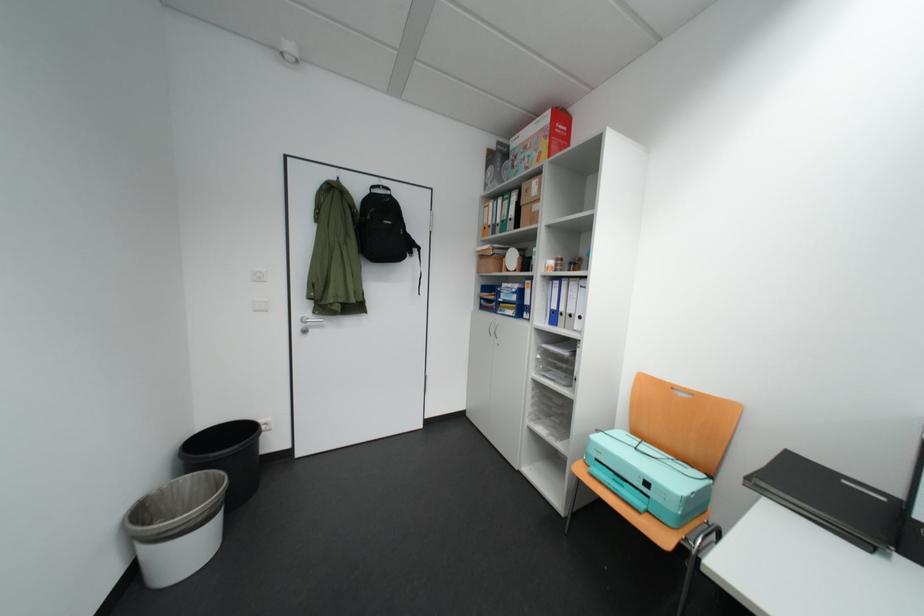
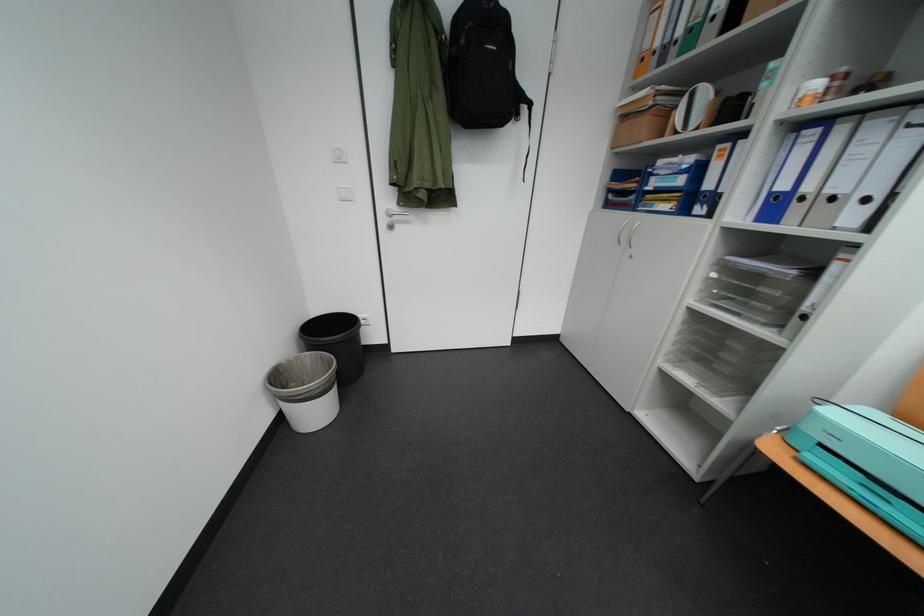
Find the pixel in the second image that matches [609,461] in the first image.

(833, 447)